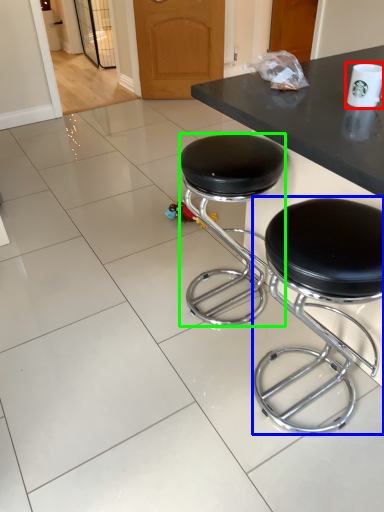
Question: Which is nearer to the paper cup (highlighted by a red box)? stool (highlighted by a blue box) or stool (highlighted by a green box).

Choices:
 (A) stool
 (B) stool

Answer: (A)